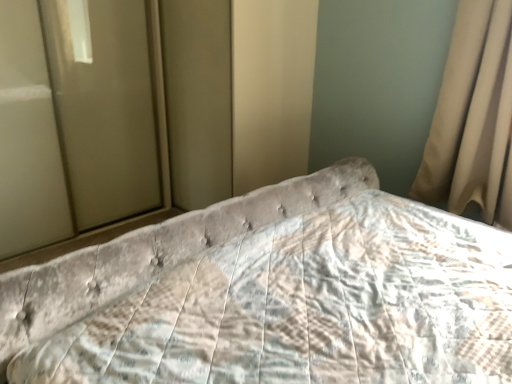
Measure the distance between point (x=308, y=305) and camera.

A distance of 3.55 feet exists between point (x=308, y=305) and camera.

I want to click on velvet tufted headboard at center, so click(x=272, y=295).

Measure the distance between point (137, 56) and camera.

The depth of point (137, 56) is 2.57 meters.

Find the location of a particular element. velvet tufted headboard at center is located at coordinates (272, 295).

Is matte glass door at left bigger or smaller than beige fabric curtain at right?

matte glass door at left is bigger than beige fabric curtain at right.

Does matte glass door at left have a greater width compared to beige fabric curtain at right?

Indeed, matte glass door at left has a greater width compared to beige fabric curtain at right.

From a real-world perspective, between matte glass door at left and beige fabric curtain at right, who is vertically lower?

matte glass door at left is physically lower.

From a real-world perspective, which object rests below the other?

velvet tufted headboard at center, from a real-world perspective.

Is the position of velvet tufted headboard at center more distant than that of matte glass door at left?

No, velvet tufted headboard at center is closer to the viewer.

How different are the orientations of velvet tufted headboard at center and matte glass door at left in degrees?

They differ by 179 degrees in their facing directions.

Is velvet tufted headboard at center not inside matte glass door at left?

Yes, velvet tufted headboard at center is not within matte glass door at left.

Where is `curtain above the velvet tufted headboard at center (from the image's perspective)`? The height and width of the screenshot is (384, 512). curtain above the velvet tufted headboard at center (from the image's perspective) is located at coordinates (471, 112).

Is point (448, 71) positioned behind point (503, 341)?

Yes, it is.

Between beige fabric curtain at right and velvet tufted headboard at center, which one has larger size?

velvet tufted headboard at center is bigger.

Which of these two, beige fabric curtain at right or velvet tufted headboard at center, is wider?

With larger width is velvet tufted headboard at center.

Is velvet tufted headboard at center turned away from beige fabric curtain at right?

velvet tufted headboard at center is not turned away from beige fabric curtain at right.

From a real-world perspective, is velvet tufted headboard at center physically above beige fabric curtain at right?

No, from a real-world perspective, velvet tufted headboard at center is not on top of beige fabric curtain at right.

Locate an element on the screen. The image size is (512, 384). curtain that is above the velvet tufted headboard at center (from a real-world perspective) is located at coordinates (471, 112).

How different are the orientations of velvet tufted headboard at center and beige fabric curtain at right in degrees?

The facing directions of velvet tufted headboard at center and beige fabric curtain at right are 91.1 degrees apart.

Is matte glass door at left facing towards velvet tufted headboard at center?

Yes.

Between point (18, 201) and point (329, 260), which one is positioned behind?

Positioned behind is point (18, 201).

Is matte glass door at left in front of or behind velvet tufted headboard at center in the image?

Visually, matte glass door at left is located behind velvet tufted headboard at center.

In the scene shown: Considering the sizes of matte glass door at left and velvet tufted headboard at center in the image, is matte glass door at left wider or thinner than velvet tufted headboard at center?

In the image, matte glass door at left appears to be more narrow than velvet tufted headboard at center.

From a real-world perspective, relative to matte glass door at left, is beige fabric curtain at right vertically above or below?

beige fabric curtain at right is situated higher than matte glass door at left in the real world.

Is beige fabric curtain at right bigger than matte glass door at left?

Incorrect, beige fabric curtain at right is not larger than matte glass door at left.

Identify the location of curtain located on the right of matte glass door at left. This screenshot has height=384, width=512. (471, 112).

In the image, there is a matte glass door at left. Where is `curtain below it (from the image's perspective)`? The image size is (512, 384). curtain below it (from the image's perspective) is located at coordinates (471, 112).

Identify the location of bed lying on the right of matte glass door at left. This screenshot has height=384, width=512. (272, 295).

Estimate the real-world distances between objects in this image. Which object is further from velvet tufted headboard at center, beige fabric curtain at right or matte glass door at left?

matte glass door at left lies further to velvet tufted headboard at center than the other object.

Which object lies further to the anchor point matte glass door at left, beige fabric curtain at right or velvet tufted headboard at center?

Based on the image, beige fabric curtain at right appears to be further to matte glass door at left.

Based on their spatial positions, is matte glass door at left or beige fabric curtain at right further from velvet tufted headboard at center?

Based on the image, matte glass door at left appears to be further to velvet tufted headboard at center.

Which object lies nearer to the anchor point beige fabric curtain at right, velvet tufted headboard at center or matte glass door at left?

Based on the image, velvet tufted headboard at center appears to be nearer to beige fabric curtain at right.

Based on their spatial positions, is matte glass door at left or velvet tufted headboard at center closer to beige fabric curtain at right?

Among the two, velvet tufted headboard at center is located nearer to beige fabric curtain at right.

When comparing their distances from matte glass door at left, does velvet tufted headboard at center or beige fabric curtain at right seem further?

beige fabric curtain at right lies further to matte glass door at left than the other object.

This screenshot has width=512, height=384. Find the location of `bed located between matte glass door at left and beige fabric curtain at right in the left-right direction`. bed located between matte glass door at left and beige fabric curtain at right in the left-right direction is located at coordinates (272, 295).